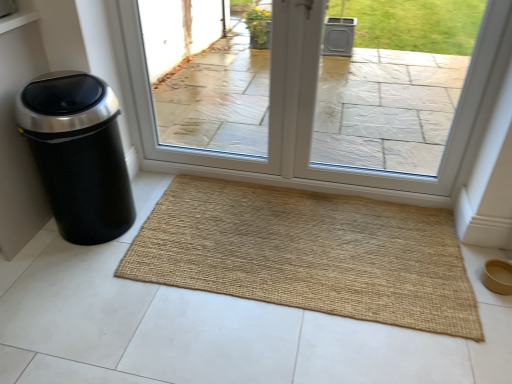
Question: Is black matte trash can at left smaller than clear glass door at center?

Choices:
 (A) yes
 (B) no

Answer: (A)

Question: Does black matte trash can at left appear on the right side of clear glass door at center?

Choices:
 (A) yes
 (B) no

Answer: (B)

Question: From the image's perspective, is black matte trash can at left over clear glass door at center?

Choices:
 (A) yes
 (B) no

Answer: (B)

Question: Is the surface of black matte trash can at left in direct contact with clear glass door at center?

Choices:
 (A) yes
 (B) no

Answer: (B)

Question: Can you confirm if black matte trash can at left is positioned to the left of clear glass door at center?

Choices:
 (A) yes
 (B) no

Answer: (A)

Question: From a real-world perspective, is black matte trash can at left on clear glass door at center?

Choices:
 (A) yes
 (B) no

Answer: (B)

Question: Is natural fiber mat at center not near black matte trash can at left?

Choices:
 (A) yes
 (B) no

Answer: (B)

Question: Considering the relative sizes of natural fiber mat at center and black matte trash can at left in the image provided, is natural fiber mat at center smaller than black matte trash can at left?

Choices:
 (A) no
 (B) yes

Answer: (B)

Question: Considering the relative sizes of natural fiber mat at center and black matte trash can at left in the image provided, is natural fiber mat at center bigger than black matte trash can at left?

Choices:
 (A) no
 (B) yes

Answer: (A)

Question: From a real-world perspective, is natural fiber mat at center on top of black matte trash can at left?

Choices:
 (A) yes
 (B) no

Answer: (B)

Question: Is natural fiber mat at center positioned in front of black matte trash can at left?

Choices:
 (A) no
 (B) yes

Answer: (A)

Question: Could black matte trash can at left be considered to be inside natural fiber mat at center?

Choices:
 (A) yes
 (B) no

Answer: (B)

Question: Is black matte trash can at left completely or partially inside clear glass door at center?

Choices:
 (A) no
 (B) yes

Answer: (A)